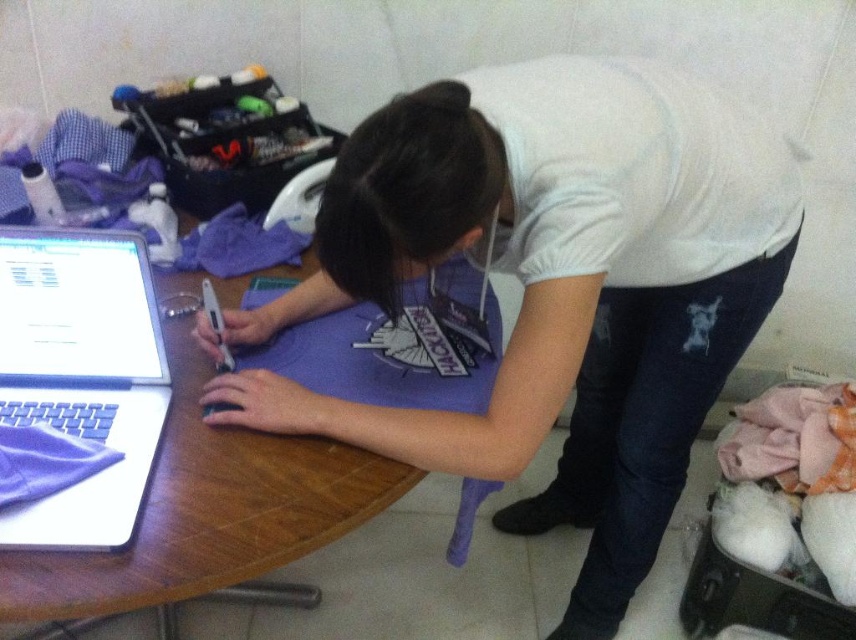
You are a delivery robot with a package that is 5 inches wide. You need to place it on the wooden table at center near the white matte laptop at left. Is there enough space between them to place the package?

The wooden table at center is 4.86 inches away from the white matte laptop at left. Since the package is 5 inches wide, it will not fit in the available space between them.